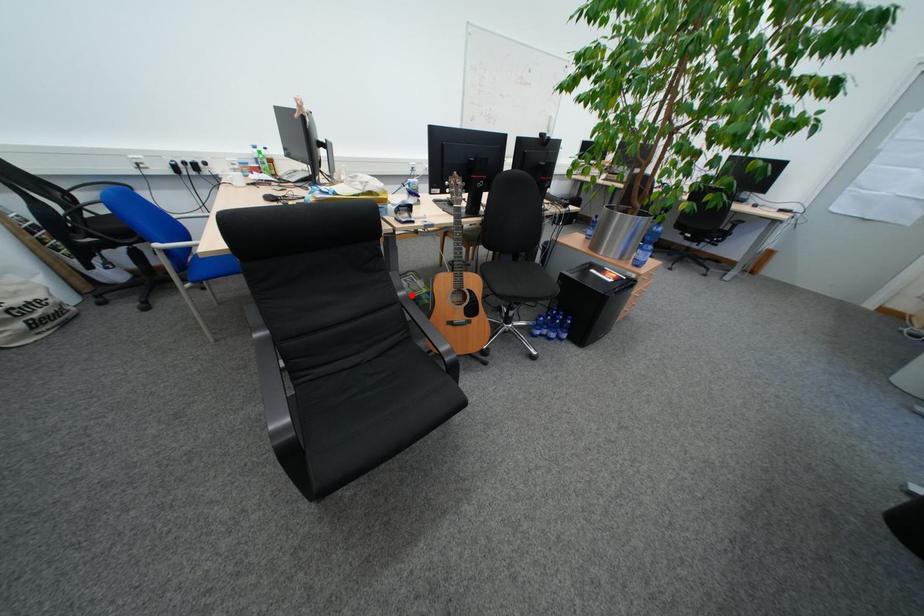
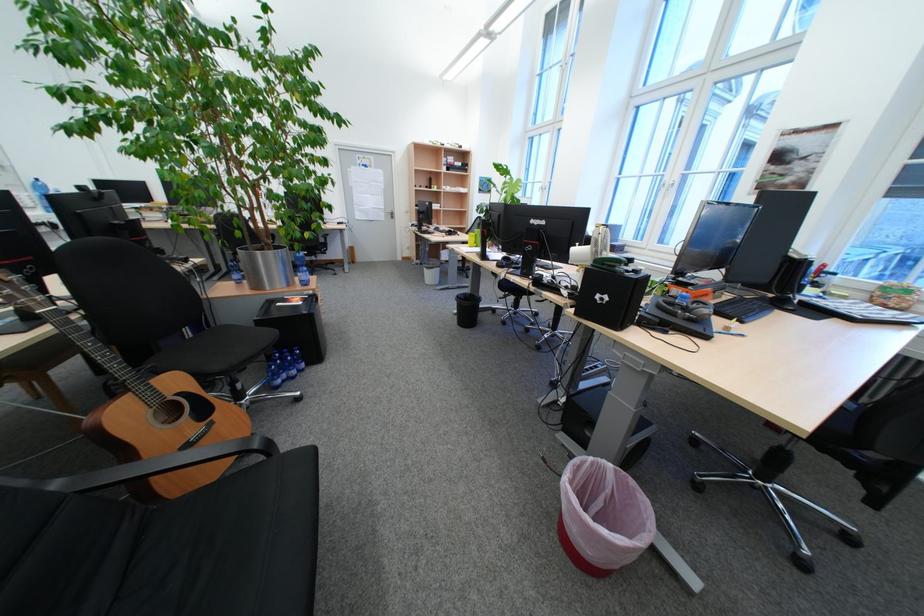
Question: I am providing you with two images of the same scene from different viewpoints. Given a red point in image1, look at the same physical point in image2. Is it:

Choices:
 (A) Closer to the viewpoint
 (B) Farther from the viewpoint

Answer: (B)